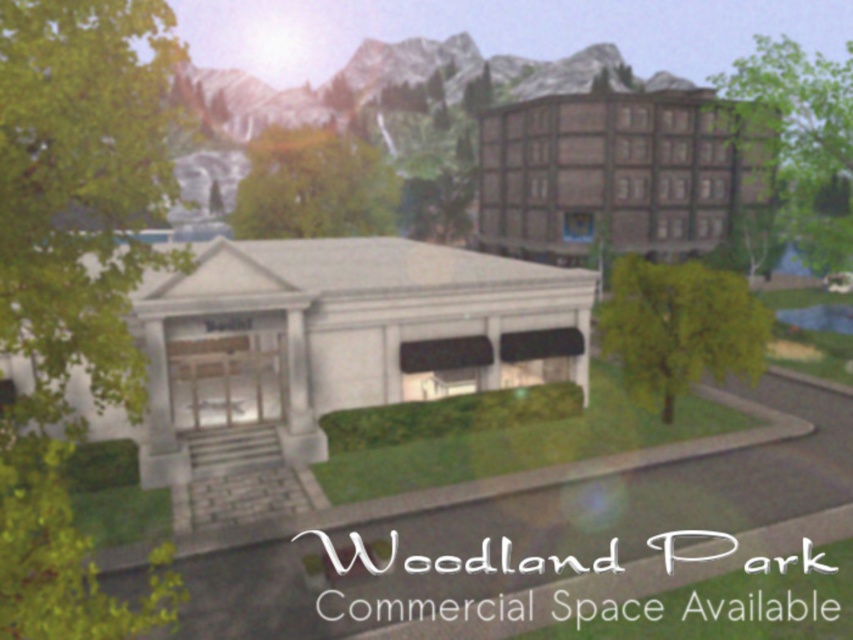
From the picture: You are a landscape architect designing a new garden. You need to place a statue between the brown wooden hotel at upper right and the green leafy tree at center right. Considering their sizes, which object should the statue be closer to?

The brown wooden hotel at upper right is larger than the green leafy tree at center right, so the statue should be placed closer to the green leafy tree at center right to balance the visual weight.

You are planning to install a new sign at the entrance of the modern building with a light colored facade. The sign needs to be placed in a position that is not obstructed by the brown wooden hotel at upper right. Based on the coordinates provided, is the sign placement at point 0.273 on the x and 0.720 on the y axis safe from obstruction?

The brown wooden hotel at upper right is located at point (613,173), so placing the sign at those coordinates would directly place it behind or within the hotel, resulting in obstruction. Choose a different location for the sign to ensure visibility.

You are a landscape architect planning to add a new pathway between the green leafy tree at upper right and the green leafy tree at center right. Based on their widths, which tree might require more space to avoid damaging its roots?

The green leafy tree at upper right might require more space because it is wider than the green leafy tree at center right.